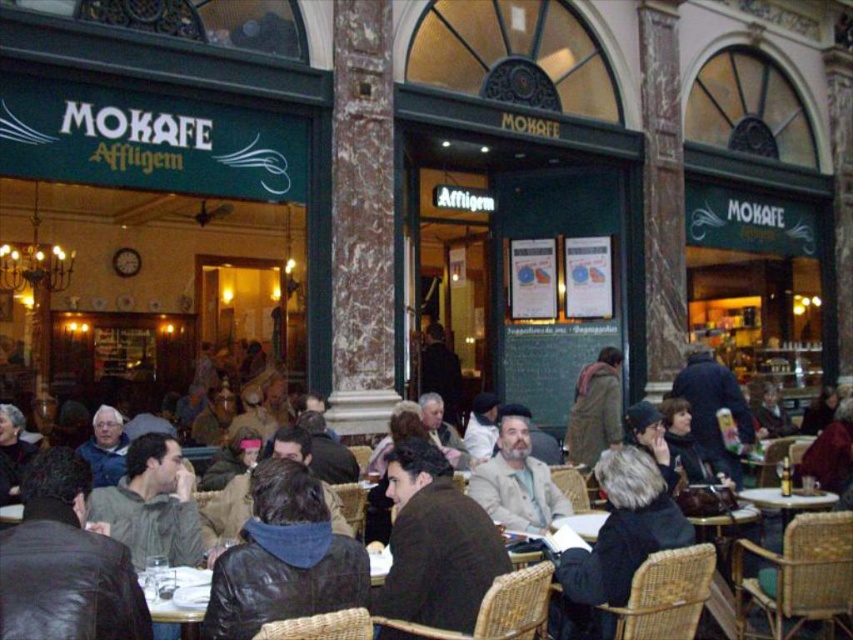
Question: Estimate the real-world distances between objects in this image. Which object is closer to the dark brown leather jacket at center?

Choices:
 (A) leather jacket at lower left
 (B) dark brown leather jacket at lower right
 (C) beige fabric jacket at center
 (D) leather jacket at center

Answer: (B)

Question: Which of these objects is positioned farthest from the leather jacket at lower left?

Choices:
 (A) dark brown leather jacket at center
 (B) beige fabric jacket at center
 (C) dark brown leather jacket at lower right

Answer: (A)

Question: Estimate the real-world distances between objects in this image. Which object is farther from the brown leather jacket at center?

Choices:
 (A) dark brown leather jacket at lower left
 (B) dark brown leather jacket at lower right
 (C) beige fabric jacket at center
 (D) leather jacket at lower left

Answer: (A)

Question: Does dark brown leather jacket at lower right have a lesser width compared to dark brown leather jacket at lower left?

Choices:
 (A) no
 (B) yes

Answer: (A)

Question: Can you confirm if dark brown leather jacket at center is bigger than brown wool coat at center?

Choices:
 (A) yes
 (B) no

Answer: (A)

Question: Does leather jacket at lower left have a greater width compared to brown leather jacket at center?

Choices:
 (A) no
 (B) yes

Answer: (B)